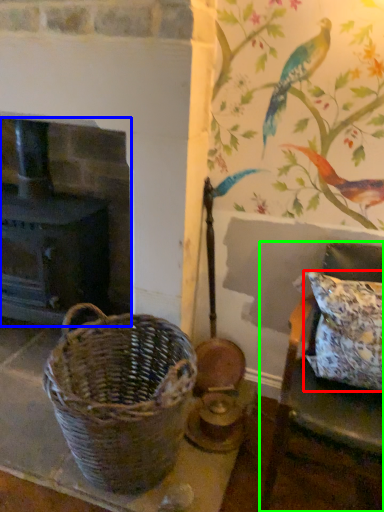
Question: Which is nearer to the pillow (highlighted by a red box)? fireplace (highlighted by a blue box) or furniture (highlighted by a green box).

Choices:
 (A) fireplace
 (B) furniture

Answer: (B)